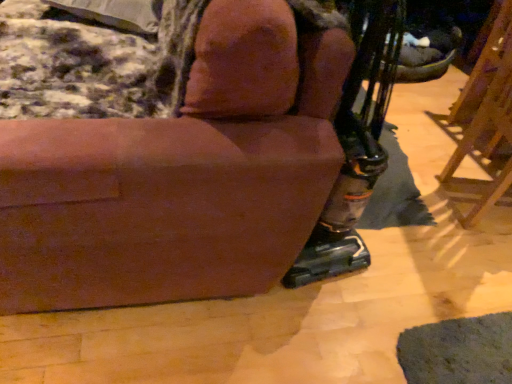
Question: Based on their sizes in the image, would you say brown wood easel at right is bigger or smaller than brown fabric chair at center?

Choices:
 (A) small
 (B) big

Answer: (A)

Question: Is point (455, 119) closer or farther from the camera than point (164, 192)?

Choices:
 (A) farther
 (B) closer

Answer: (A)

Question: Which of these objects is positioned closest to the velvety gray pillow at upper left?

Choices:
 (A) brown fabric chair at center
 (B) brown wood easel at right

Answer: (A)

Question: Estimate the real-world distances between objects in this image. Which object is closer to the brown fabric chair at center?

Choices:
 (A) brown wood easel at right
 (B) velvety gray pillow at upper left

Answer: (B)